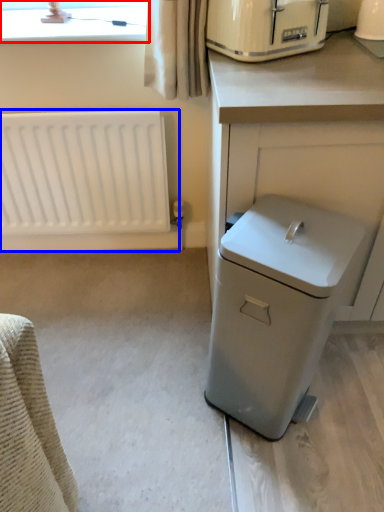
Question: Which of the following is the closest to the observer, bay window (highlighted by a red box) or radiator (highlighted by a blue box)?

Choices:
 (A) bay window
 (B) radiator

Answer: (A)